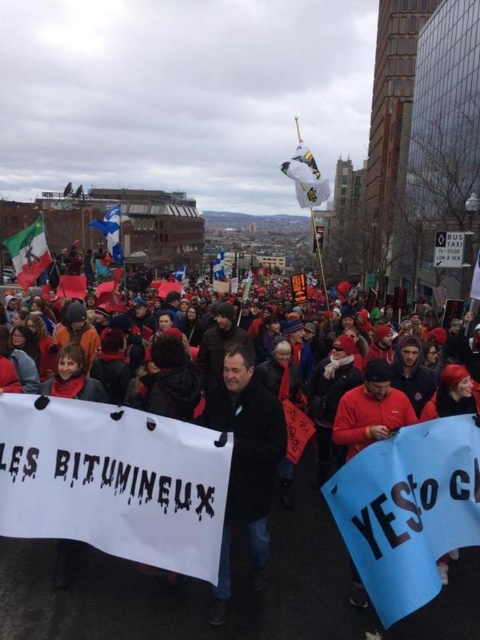
You are a photographer at the demonstration and want to capture both the white paper banner at center and the black matte coat at center in a single shot. Based on their positions, which object should you position closer to the left side of your camera frame?

The white paper banner at center should be positioned closer to the left side of your camera frame because it is located to the left of the black matte coat at center.

You are a photographer standing at point (28,252). You want to capture a photo of the crowd holding signs and banners. However, there is an object blocking your view. What is the object blocking your view?

The matte plastic flag at left is blocking your view because it is located at point (28,252) where you are standing.